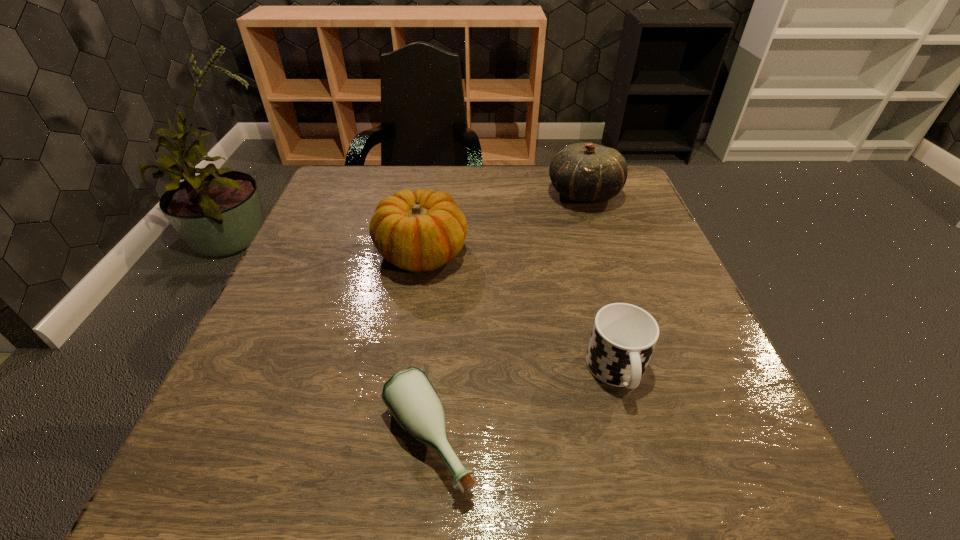
You are a GUI agent. You are given a task and a screenshot of the screen. Output one action in this format:
    pyautogui.click(x=<x>, y=<y>)
    Task: Click on the object identified as the closest to the left gourd
    
    Given the screenshot: What is the action you would take?
    pyautogui.click(x=585, y=172)

The image size is (960, 540). Identify the location of object that ranks as the closest to the second farthest object. (585, 172).

Find the location of `free space that satisfies the following two spatial constraints: 1. on the back side of the farther gourd; 2. on the left side of the shortest object`. free space that satisfies the following two spatial constraints: 1. on the back side of the farther gourd; 2. on the left side of the shortest object is located at coordinates (450, 194).

The width and height of the screenshot is (960, 540). I want to click on free space that satisfies the following two spatial constraints: 1. on the back side of the right gourd; 2. on the right side of the left gourd, so coord(431,194).

Image resolution: width=960 pixels, height=540 pixels. I want to click on vacant region that satisfies the following two spatial constraints: 1. on the back side of the right gourd; 2. on the left side of the shortest object, so click(x=450, y=194).